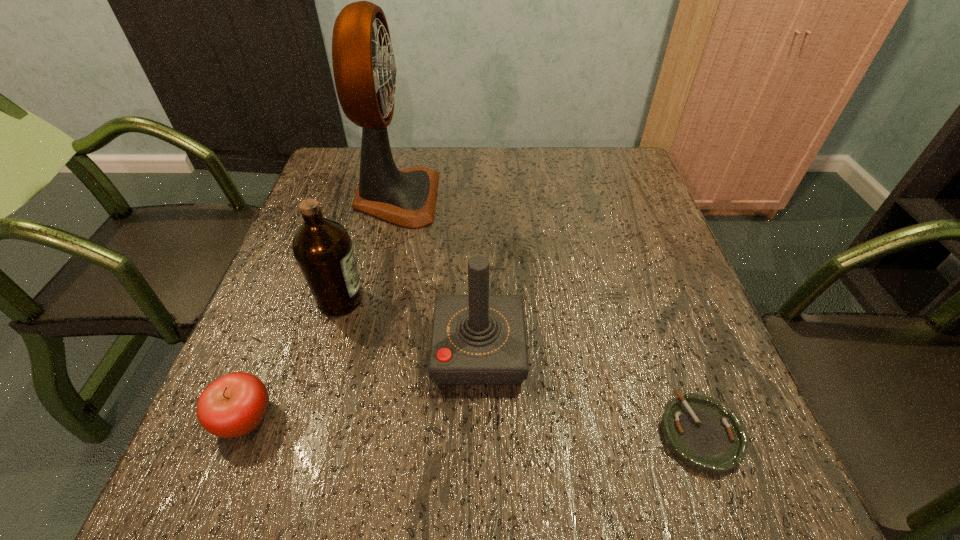
Where is `blank area at the near edge`? Image resolution: width=960 pixels, height=540 pixels. blank area at the near edge is located at coordinates (472, 489).

At what (x,y) coordinates should I click in order to perform the action: click on vacant point at the left edge. Please return your answer as a coordinate pair (x, y). The width and height of the screenshot is (960, 540). Looking at the image, I should click on (272, 443).

Find the location of a particular element. vacant space at the right edge of the desktop is located at coordinates (707, 372).

Where is `free region at the far left corner`? The height and width of the screenshot is (540, 960). free region at the far left corner is located at coordinates (350, 187).

You are a GUI agent. You are given a task and a screenshot of the screen. Output one action in this format:
    pyautogui.click(x=<x>, y=<y>)
    Task: Click on the free space at the near left corner of the desktop
    This screenshot has height=540, width=960.
    Given the screenshot: What is the action you would take?
    pyautogui.click(x=277, y=477)

Where is `vacant area between the olive oil and the fourth object from left to right`? vacant area between the olive oil and the fourth object from left to right is located at coordinates (410, 325).

I want to click on unoccupied position between the olive oil and the fourth tallest object, so click(x=293, y=359).

I want to click on vacant space that is in between the fourth tallest object and the rightmost object, so click(472, 426).

Identify the location of unoccupied position between the tallest object and the rightmost object. The width and height of the screenshot is (960, 540). (548, 315).

Locate an element on the screen. This screenshot has height=540, width=960. vacant point located between the olive oil and the farthest object is located at coordinates (369, 249).